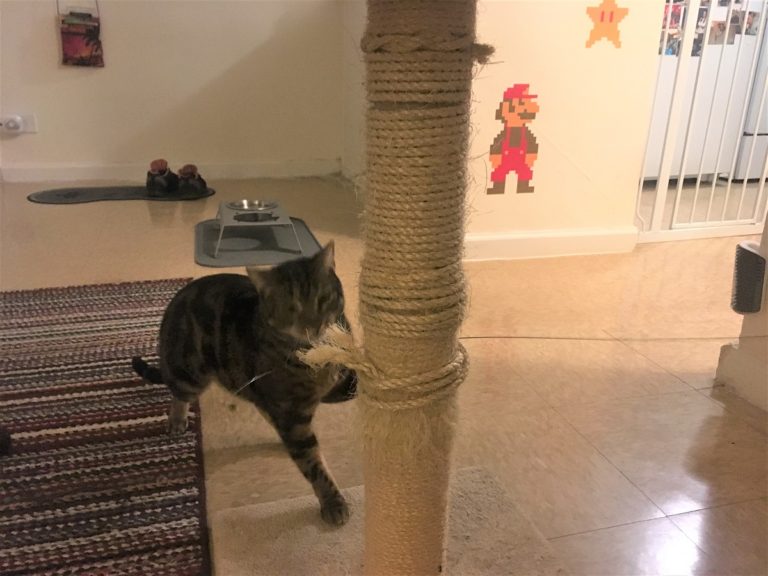
This screenshot has width=768, height=576. I want to click on scratching post, so click(408, 322).